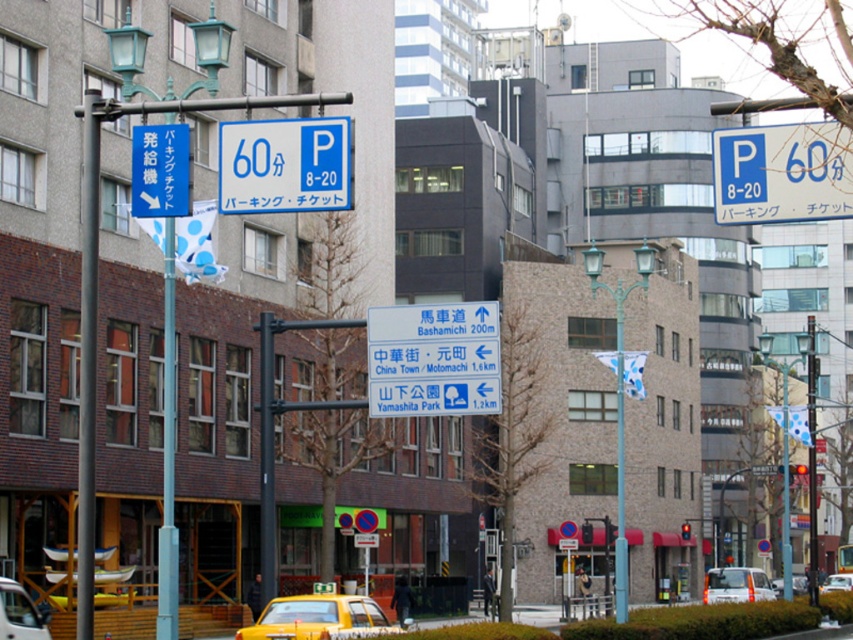
Can you confirm if blue plastic sign at upper left is positioned above red glass traffic light at center?

Correct, blue plastic sign at upper left is located above red glass traffic light at center.

Who is higher up, blue plastic sign at upper left or red glass traffic light at center?

Positioned higher is blue plastic sign at upper left.

Does point (167, 216) come closer to viewer compared to point (683, 529)?

Yes.

This screenshot has width=853, height=640. In order to click on blue plastic sign at upper left in this screenshot , I will do `click(160, 170)`.

Does blue plastic parking sign at upper right have a lesser height compared to yellow matte taxi cab at lower left?

In fact, blue plastic parking sign at upper right may be taller than yellow matte taxi cab at lower left.

Is point (734, 224) behind point (0, 620)?

No, it is in front of (0, 620).

Find the location of a particular element. The image size is (853, 640). blue plastic parking sign at upper right is located at coordinates (782, 172).

Between blue plastic parking sign at upper right and red glass traffic light at center, which one has more height?

blue plastic parking sign at upper right is taller.

Does point (773, 138) lie in front of point (688, 532)?

Yes, it is in front of point (688, 532).

Is point (714, 180) closer to viewer compared to point (685, 524)?

Yes, point (714, 180) is closer to viewer.

Identify the location of blue plastic parking sign at upper right. (782, 172).